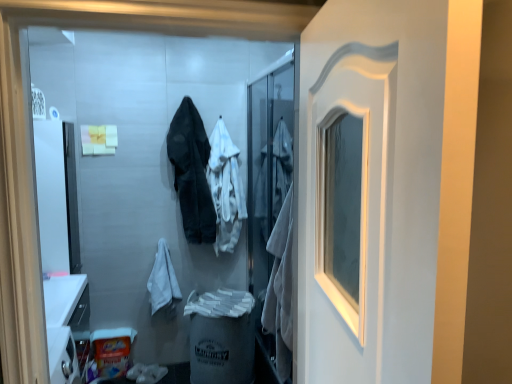
Question: In the image, is white matte screen door at center on the left side or the right side of white cotton hoodie at center, the first clothing when ordered from right to left?

Choices:
 (A) left
 (B) right

Answer: (B)

Question: Is white matte screen door at center in front of or behind white cotton hoodie at center, the 2th clothing from the left, in the image?

Choices:
 (A) behind
 (B) front

Answer: (B)

Question: Estimate the real-world distances between objects in this image. Which object is closer to the white cotton bathrobe at lower left?

Choices:
 (A) dark gray fabric coat at center, the second clothing positioned from the right
 (B) white matte screen door at center
 (C) white glossy door at center
 (D) white cotton hoodie at center, the 2th clothing from the left

Answer: (A)

Question: Based on their relative distances, which object is nearer to the white glossy door at center?

Choices:
 (A) white cotton bathrobe at lower left
 (B) white cotton hoodie at center, the first clothing when ordered from right to left
 (C) dark gray fabric coat at center, the second clothing positioned from the right
 (D) white matte screen door at center

Answer: (D)